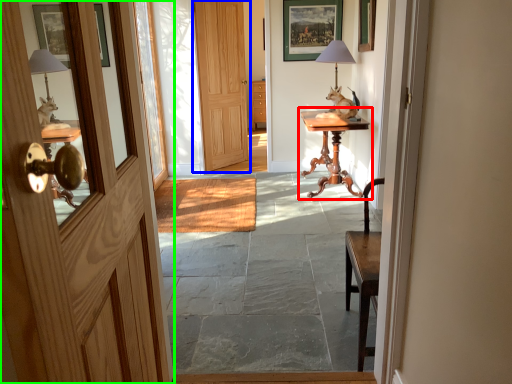
Question: Based on their relative distances, which object is farther from table (highlighted by a red box)? Choose from door (highlighted by a blue box) and door (highlighted by a green box).

Choices:
 (A) door
 (B) door

Answer: (B)